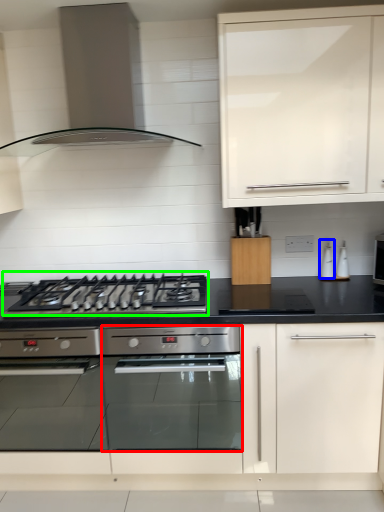
Question: Considering the real-world distances, which object is farthest from oven (highlighted by a red box)? appliance (highlighted by a blue box) or gas stove (highlighted by a green box)?

Choices:
 (A) appliance
 (B) gas stove

Answer: (A)